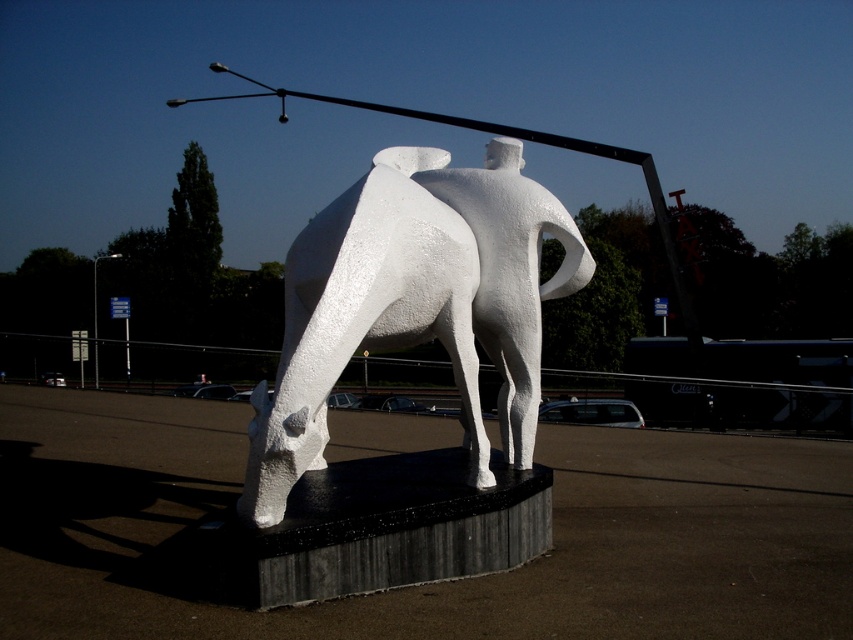
You are a visitor standing in front of the sculpture. You notice a metallic pole at left and a white matte sculpture at center. Which object is positioned to the right of the other?

The white matte sculpture at center is positioned to the right of the metallic pole at left.

From the picture: You are standing in front of the sculpture and want to take a photo that includes both the white matte sculpture at center and the metallic pole at left. Which object should you position closer to the camera to ensure both are fully visible in the frame?

To ensure both the white matte sculpture at center and the metallic pole at left are fully visible in the frame, position the white matte sculpture at center closer to the camera since it is in front of the metallic pole at left.